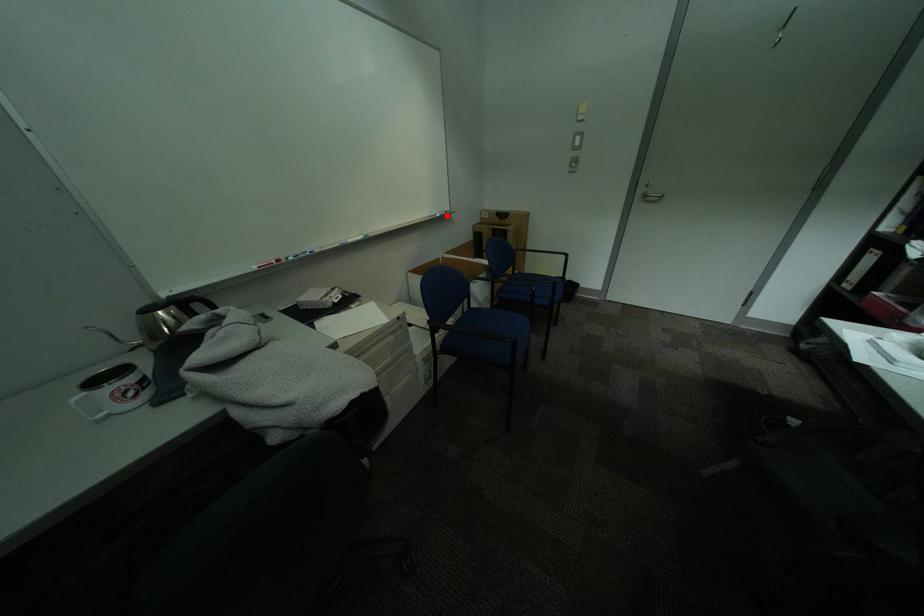
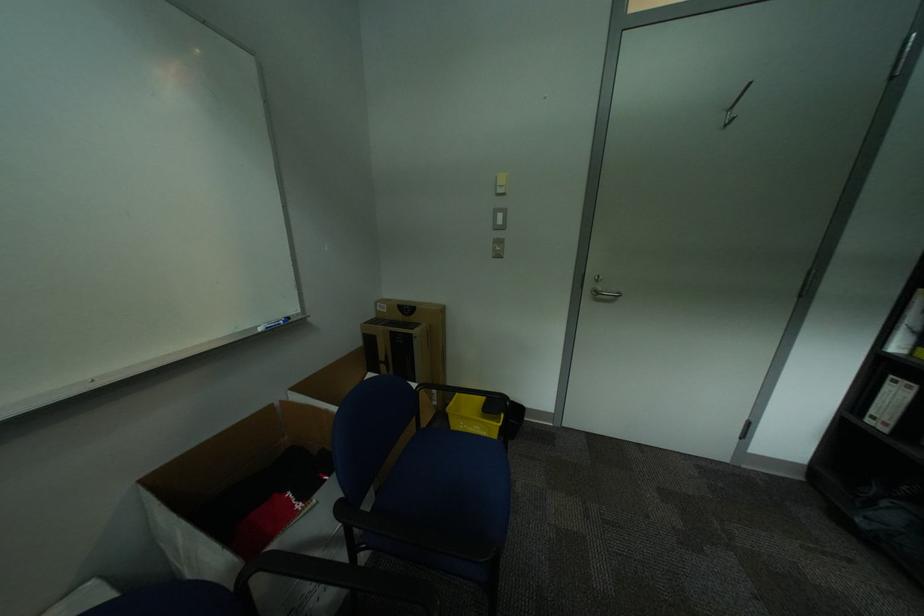
In the second image, find the point that corresponds to the highlighted location in the first image.

(266, 329)